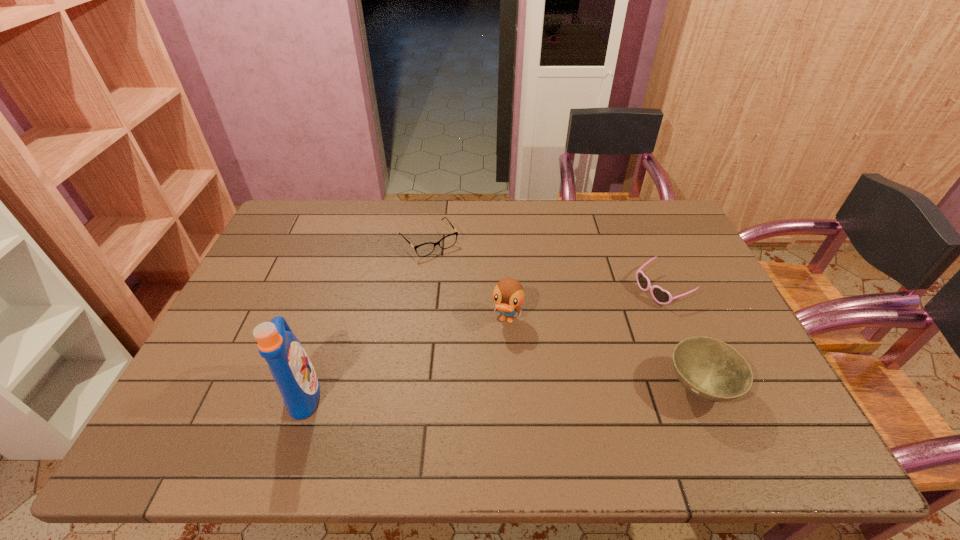
This screenshot has width=960, height=540. I want to click on detergent located at the near edge, so click(x=289, y=364).

You are a GUI agent. You are given a task and a screenshot of the screen. Output one action in this format:
    pyautogui.click(x=<x>, y=<y>)
    Task: Click on the bowl situated at the near edge
    
    Given the screenshot: What is the action you would take?
    (710, 369)

This screenshot has height=540, width=960. Find the location of `bowl at the right edge`. bowl at the right edge is located at coordinates (710, 369).

Find the location of a particular element. The image size is (960, 540). sunglasses at the right edge is located at coordinates (661, 296).

You are a GUI agent. You are given a task and a screenshot of the screen. Output one action in this format:
    pyautogui.click(x=<x>, y=<y>)
    Task: Click on the object present at the near right corner
    Image resolution: width=960 pixels, height=540 pixels.
    Given the screenshot: What is the action you would take?
    pyautogui.click(x=710, y=369)

Where is `vacant space at the far edge`? vacant space at the far edge is located at coordinates (391, 230).

At what (x,y) coordinates should I click in order to perform the action: click on free location at the near edge. Please return your answer as a coordinate pair (x, y). Looking at the image, I should click on (637, 394).

Where is `vacant space at the left edge of the desktop`? Image resolution: width=960 pixels, height=540 pixels. vacant space at the left edge of the desktop is located at coordinates (254, 310).

Identify the location of free region at the right edge. (709, 291).

You are a GUI agent. You are given a task and a screenshot of the screen. Output one action in this format:
    pyautogui.click(x=<x>, y=<y>)
    Task: Click on the free space at the far left corner of the desktop
    This screenshot has width=960, height=540.
    Given the screenshot: What is the action you would take?
    pyautogui.click(x=276, y=227)